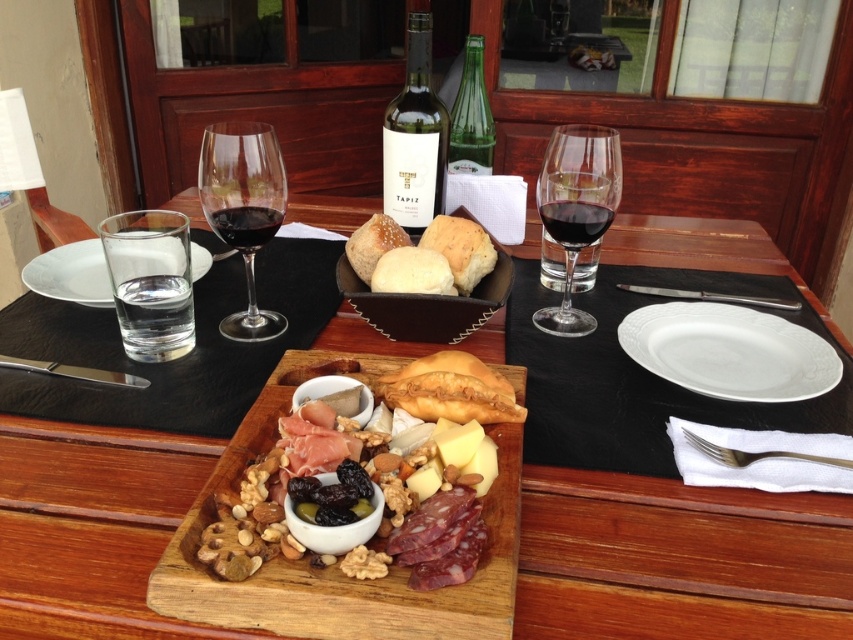
Question: Is matte glass bottle at center positioned before golden crusty bread at center?

Choices:
 (A) yes
 (B) no

Answer: (B)

Question: Considering the real-world distances, which object is closest to the translucent glass wine at upper right?

Choices:
 (A) wooden cutting board at center
 (B) matte glass bottle at center
 (C) silver/golden metal fork at lower right
 (D) silver metallic knife at upper right

Answer: (D)

Question: Can you confirm if transparent glass wine glass at upper center is positioned below matte glass bottle at center?

Choices:
 (A) yes
 (B) no

Answer: (A)

Question: Which point is closer to the camera?

Choices:
 (A) (280, 216)
 (B) (410, 77)

Answer: (A)

Question: In this image, where is wooden tray at center located relative to matte glass bottle at center?

Choices:
 (A) left
 (B) right

Answer: (A)

Question: Among these points, which one is farthest from the camera?

Choices:
 (A) (767, 458)
 (B) (590, 134)
 (C) (384, 157)

Answer: (C)